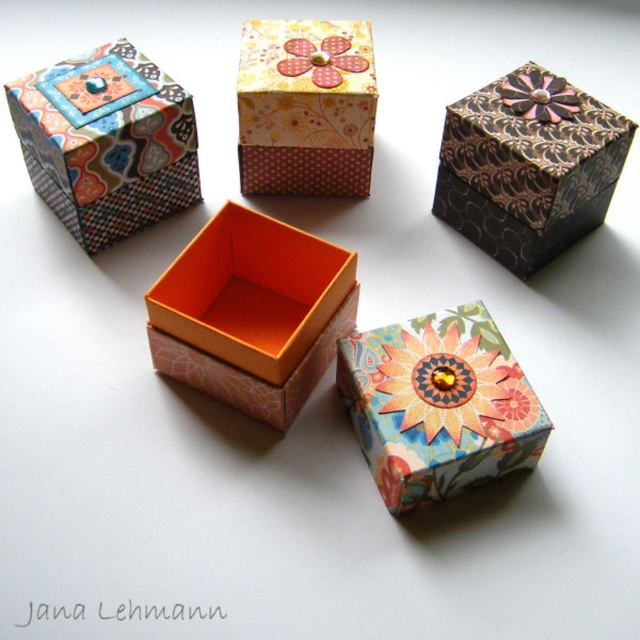
Question: Which object appears farthest from the camera in this image?

Choices:
 (A) brown textured box at upper right
 (B) floral paper gift box at center
 (C) matte paper gift box at upper left

Answer: (C)

Question: Is matte paper gift box at upper left bigger than pink fabric flower at upper center?

Choices:
 (A) no
 (B) yes

Answer: (B)

Question: Is matte paper gift box at upper left in front of metallic gold flower at upper right?

Choices:
 (A) yes
 (B) no

Answer: (A)

Question: Considering the real-world distances, which object is closest to the brown textured box at upper right?

Choices:
 (A) metallic gold flower at upper right
 (B) floral paper gift box at center
 (C) matte paper gift box at upper left

Answer: (A)

Question: Which object is the closest to the orange matte box at center?

Choices:
 (A) pink fabric flower at upper center
 (B) floral paper gift box at upper center
 (C) brown textured box at upper right

Answer: (B)

Question: Considering the relative positions of brown textured box at upper right and metallic gold flower at upper right in the image provided, where is brown textured box at upper right located with respect to metallic gold flower at upper right?

Choices:
 (A) right
 (B) left

Answer: (B)